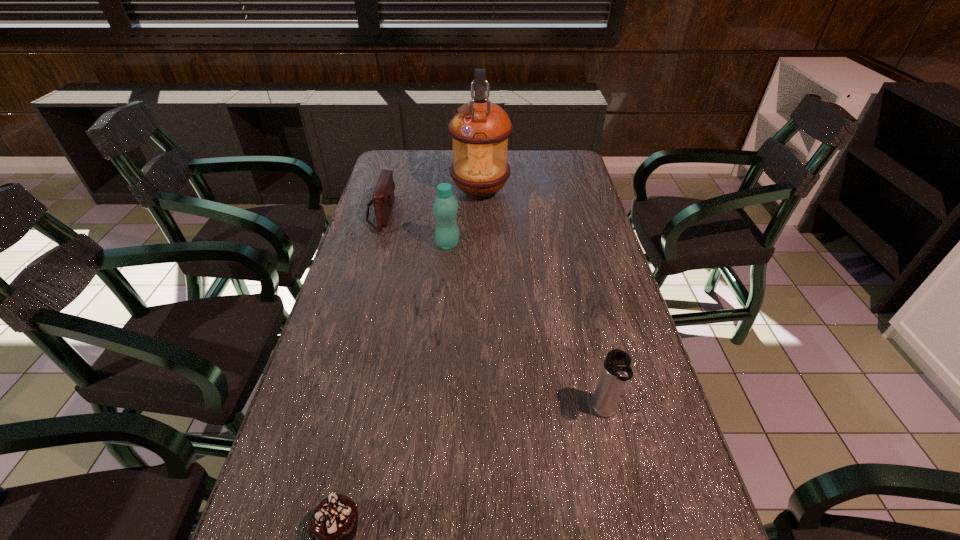
Find the location of a particular element. vacant region that satisfies the following two spatial constraints: 1. on the front flap of the shoulder bag; 2. on the right side of the third nearest object is located at coordinates (372, 245).